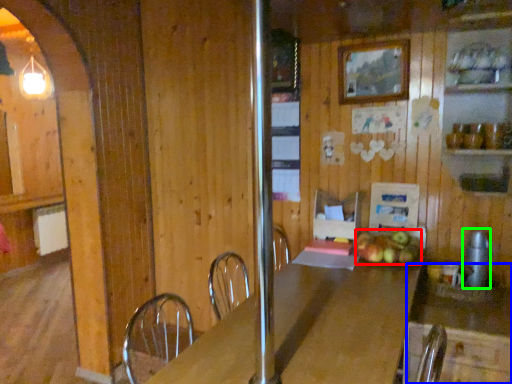
Question: Which is nearer to the apple (highlighted by a red box)? counter (highlighted by a blue box) or appliance (highlighted by a green box).

Choices:
 (A) counter
 (B) appliance

Answer: (A)